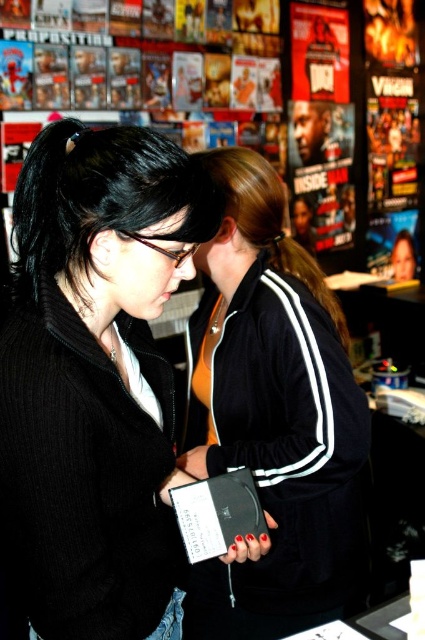
Between black matte jacket at center and black velour jacket at center, which one is positioned lower?

black velour jacket at center

Who is positioned more to the right, black matte jacket at center or black velour jacket at center?

Positioned to the right is black velour jacket at center.

Identify the location of black matte jacket at center. (96, 378).